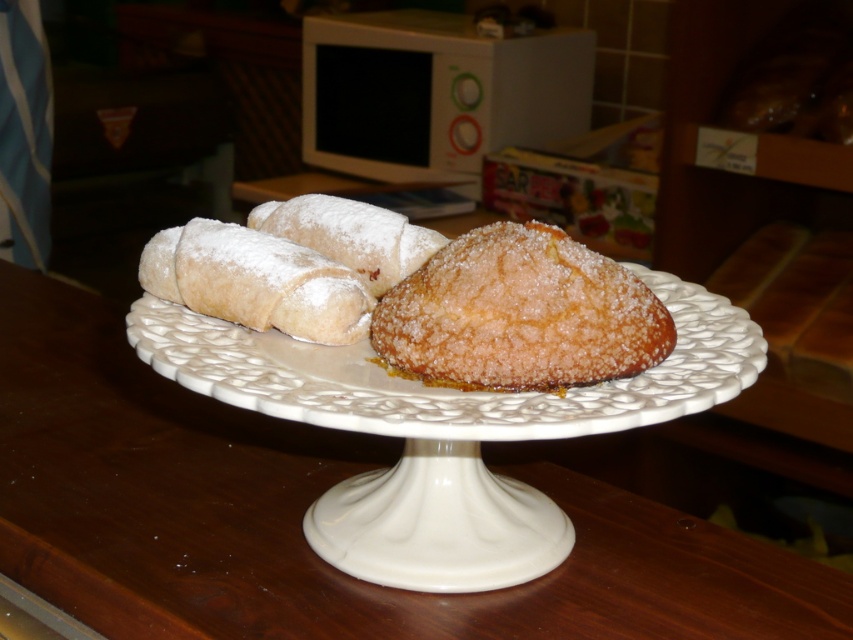
Is white ceramic plate at center to the left of sugared golden brown pastry at center from the viewer's perspective?

Correct, you'll find white ceramic plate at center to the left of sugared golden brown pastry at center.

Is white ceramic plate at center wider than sugared golden brown pastry at center?

Correct, the width of white ceramic plate at center exceeds that of sugared golden brown pastry at center.

Between point (630, 424) and point (412, 280), which one is positioned behind?

The point (412, 280) is behind.

Locate an element on the screen. Image resolution: width=853 pixels, height=640 pixels. white ceramic plate at center is located at coordinates (450, 388).

Does white ceramic cake stand at center have a lesser height compared to white ceramic plate at center?

No, white ceramic cake stand at center is not shorter than white ceramic plate at center.

How far apart are white ceramic cake stand at center and white ceramic plate at center?

A distance of 7.79 inches exists between white ceramic cake stand at center and white ceramic plate at center.

This screenshot has width=853, height=640. What do you see at coordinates (303, 513) in the screenshot?
I see `white ceramic cake stand at center` at bounding box center [303, 513].

You are a GUI agent. You are given a task and a screenshot of the screen. Output one action in this format:
    pyautogui.click(x=<x>, y=<y>)
    Task: Click on the white ceramic cake stand at center
    
    Given the screenshot: What is the action you would take?
    pyautogui.click(x=303, y=513)

Which is more to the left, white ceramic cake stand at center or sugared golden brown pastry at center?

From the viewer's perspective, white ceramic cake stand at center appears more on the left side.

In order to click on white ceramic cake stand at center in this screenshot , I will do `click(303, 513)`.